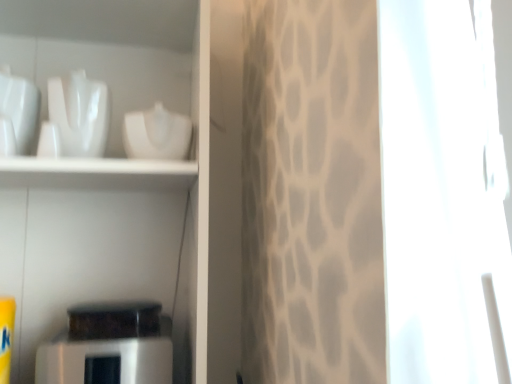
At what (x,y) coordinates should I click in order to perform the action: click on white glossy bowl at upper center. Please return your answer as a coordinate pair (x, y). The image size is (512, 384). Looking at the image, I should click on (156, 134).

Measure the distance between white glossy bowl at upper center and camera.

white glossy bowl at upper center and camera are 31.79 inches apart.

What do you see at coordinates (156, 134) in the screenshot? This screenshot has width=512, height=384. I see `white glossy bowl at upper center` at bounding box center [156, 134].

The width and height of the screenshot is (512, 384). In order to click on white glossy bowl at upper center in this screenshot , I will do `click(156, 134)`.